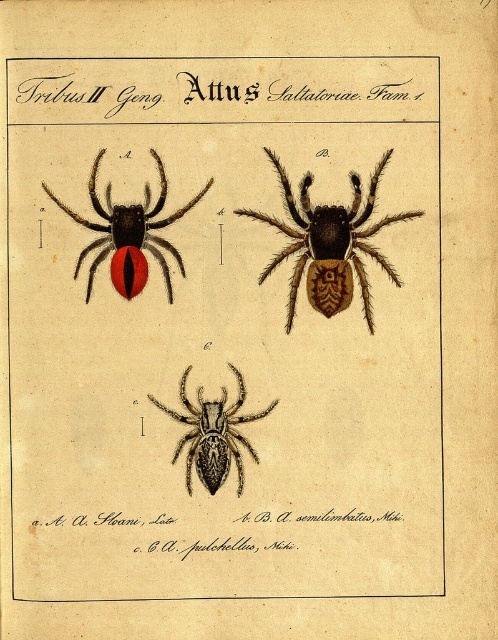
Question: Is brown textured spider at upper center thinner than black textured spider at center?

Choices:
 (A) yes
 (B) no

Answer: (B)

Question: Is brown textured spider at upper center below black textured spider at center?

Choices:
 (A) no
 (B) yes

Answer: (A)

Question: Does matte black spider at upper left have a lesser width compared to black textured spider at center?

Choices:
 (A) yes
 (B) no

Answer: (B)

Question: Which point is closer to the camera?

Choices:
 (A) black textured spider at center
 (B) brown textured spider at upper center

Answer: (A)

Question: Which object is positioned farthest from the black textured spider at center?

Choices:
 (A) brown textured spider at upper center
 (B) matte black spider at upper left

Answer: (A)

Question: Based on their relative distances, which object is farther from the black textured spider at center?

Choices:
 (A) matte black spider at upper left
 (B) brown textured spider at upper center

Answer: (B)